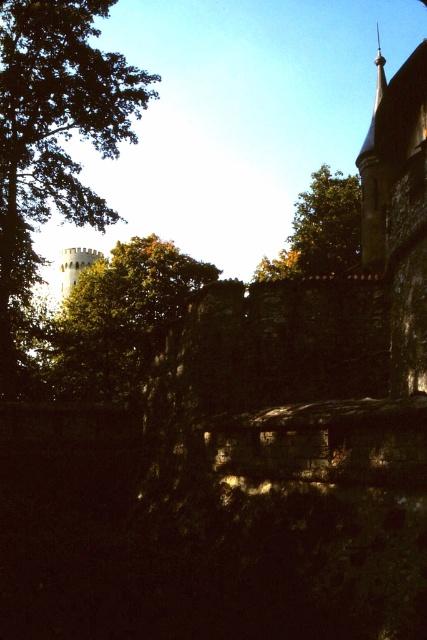
Measure the distance between green leafy tree at left and green leafy tree at upper left.

The distance of green leafy tree at left from green leafy tree at upper left is 6.23 meters.

Is green leafy tree at left above green leafy tree at upper left?

Yes, green leafy tree at left is above green leafy tree at upper left.

Who is more distant from viewer, (17, 90) or (110, 387)?

The point (110, 387) is behind.

Where is `green leafy tree at left`? The width and height of the screenshot is (427, 640). green leafy tree at left is located at coordinates (53, 132).

Which is above, green leafy tree at upper center or white stone water tower at left?

green leafy tree at upper center is higher up.

Is green leafy tree at upper center above white stone water tower at left?

Yes, green leafy tree at upper center is above white stone water tower at left.

Which is behind, point (357, 236) or point (63, 273)?

Positioned behind is point (63, 273).

The image size is (427, 640). I want to click on green leafy tree at upper center, so click(319, 230).

Does green leafy tree at left have a greater height compared to green leafy tree at upper center?

Correct, green leafy tree at left is much taller as green leafy tree at upper center.

Does green leafy tree at left appear under green leafy tree at upper center?

Incorrect, green leafy tree at left is not positioned below green leafy tree at upper center.

I want to click on green leafy tree at left, so click(53, 132).

Identify the location of green leafy tree at left. (53, 132).